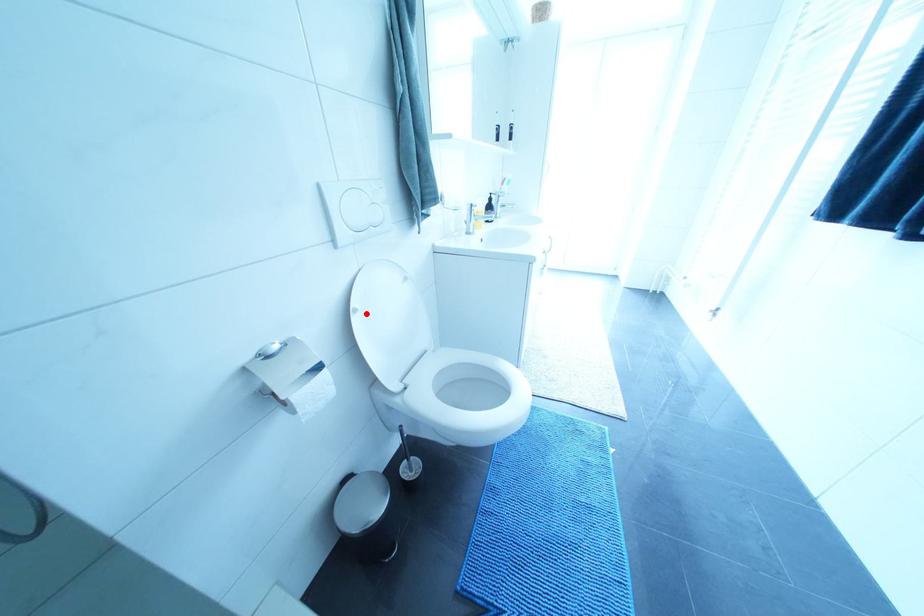
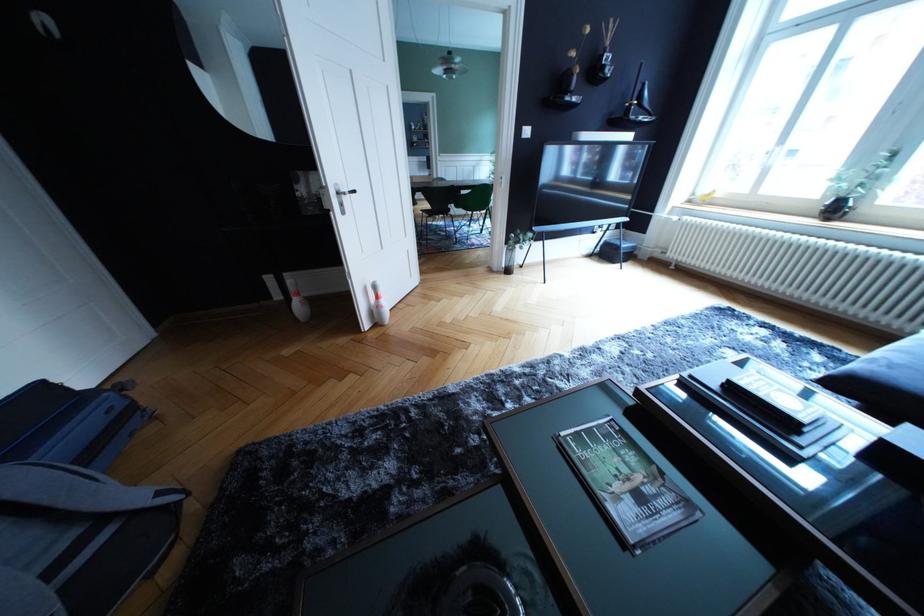
Question: I am providing you with two images of the same scene from different viewpoints. A red point is marked on the first image. At the location where the point appears in image 1, is it still visible in image 2?

Choices:
 (A) Yes
 (B) No

Answer: (B)